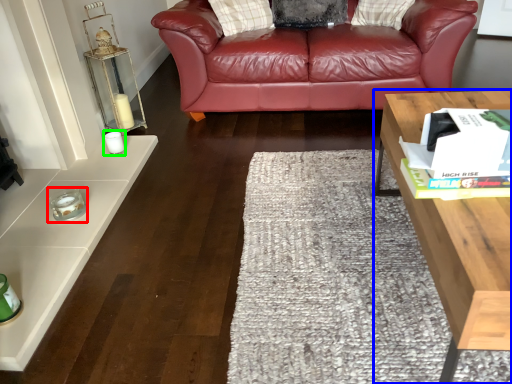
Question: Estimate the real-world distances between objects in this image. Which object is closer to candle holder (highlighted by a red box), table (highlighted by a blue box) or candle holder (highlighted by a green box)?

Choices:
 (A) table
 (B) candle holder

Answer: (B)